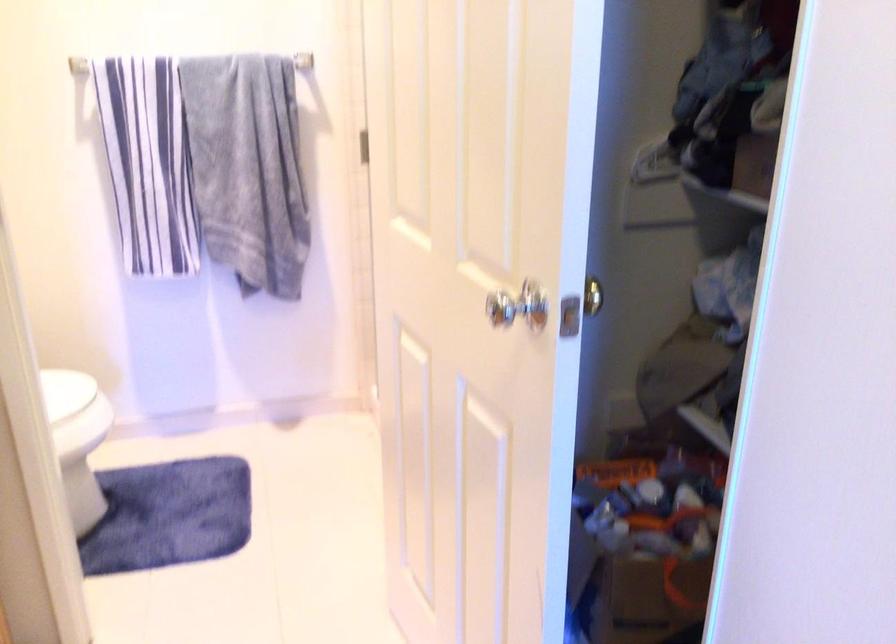
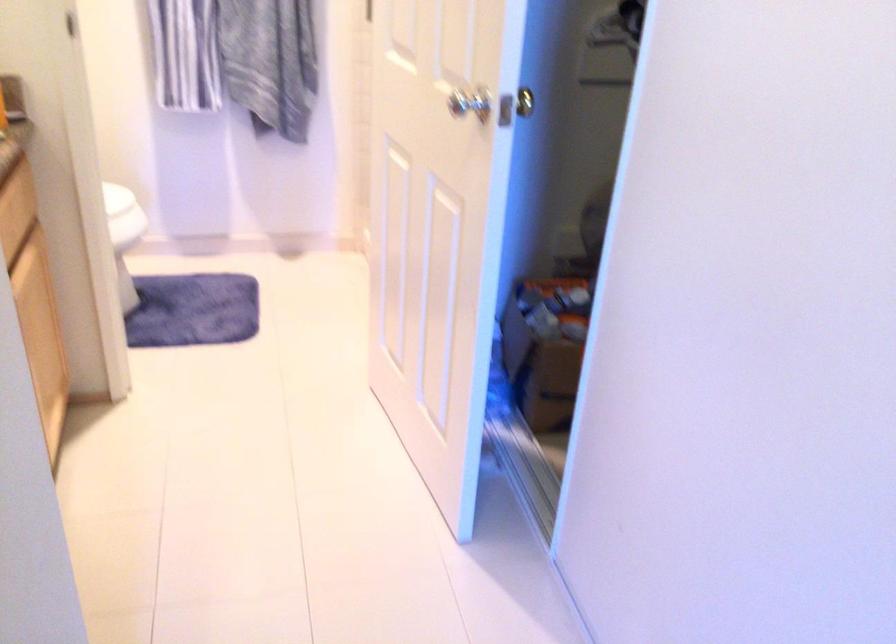
Question: Based on the continuous images, in which direction is the camera rotating? Reply with the corresponding letter.

Choices:
 (A) Left
 (B) Right
 (C) Up
 (D) Down

Answer: (D)